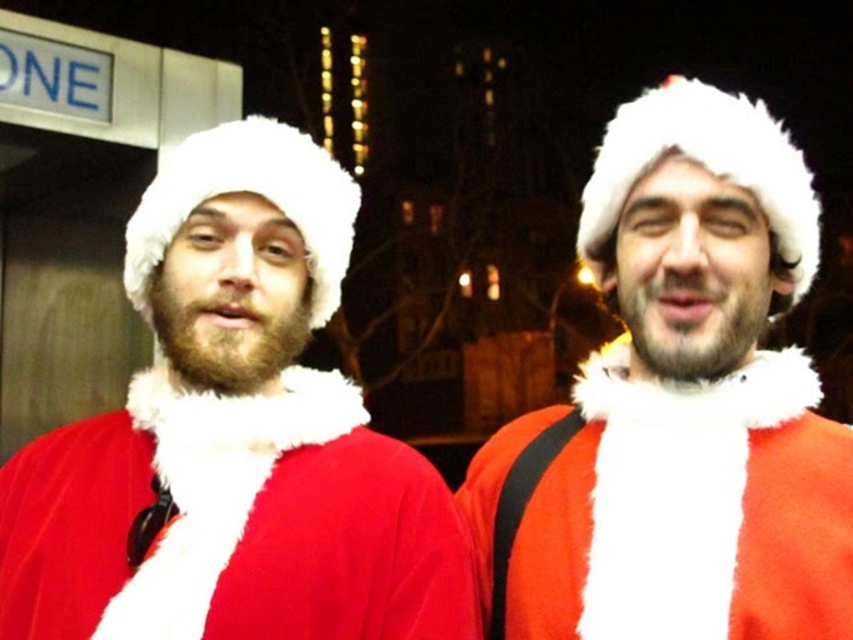
From the picture: You are a delivery drone trying to navigate between two points in the image. The first point is point (236,256) and the second point is point (637,289). According to the scene, which point is closer to the delivery drone when it is positioned at the starting point?

Point (637,289) is closer to the delivery drone at the starting point because point (236,256) is behind point (637,289).

You are a photographer trying to capture both the velvet red santa suit at center and the matte red santa suit at center in a single frame. Based on their positions and sizes, which Santa suit is wider?

The velvet red santa suit at center is wider than the matte red santa suit at center.

You are a costume designer observing the two Santa Claus figures in the image. Both are wearing red Santa suits at the center of the scene. Which of the two suits, the velvet red santa suit at center or the matte red santa suit at center, appears shorter in height?

The velvet red santa suit at center appears shorter in height compared to the matte red santa suit at center.